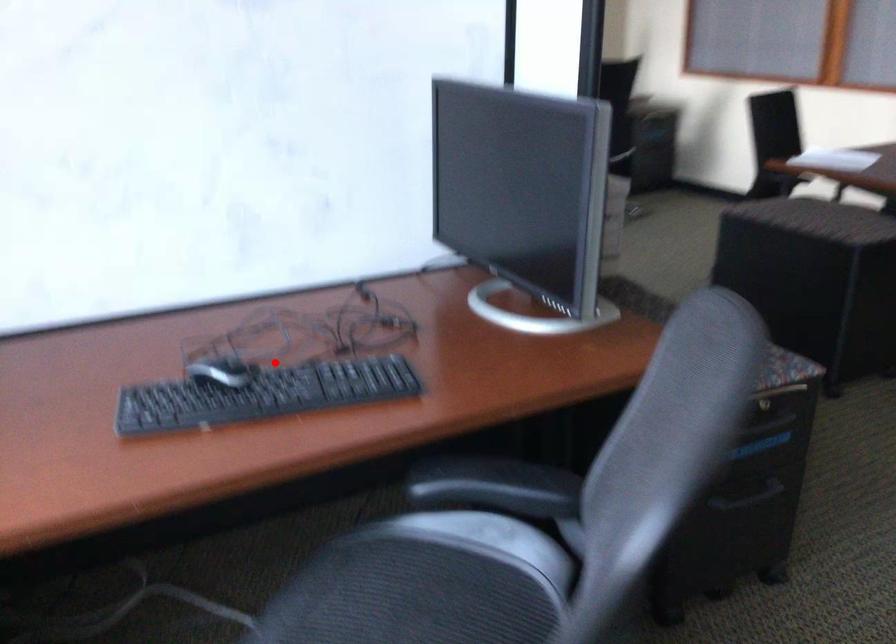
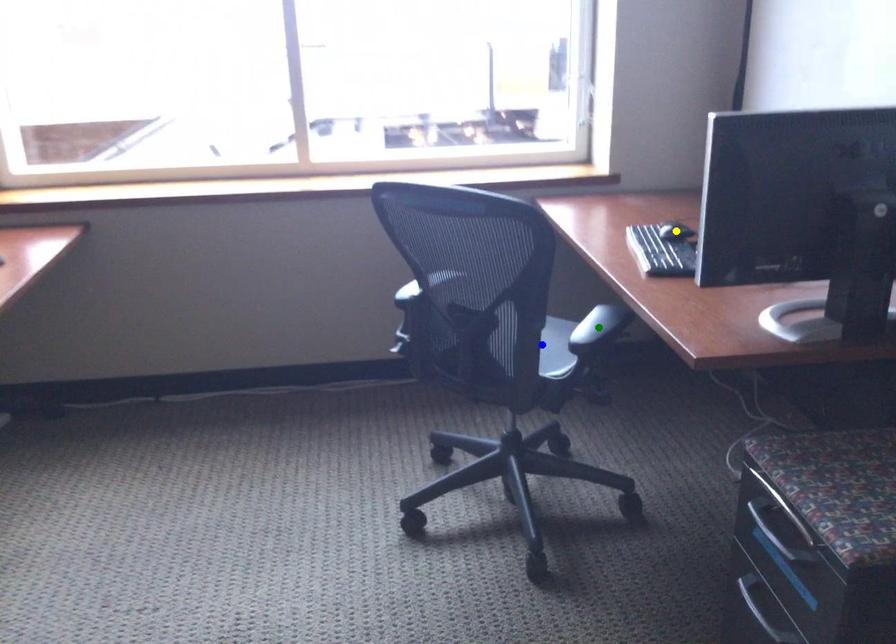
Question: I am providing you with two images of the same scene from different viewpoints. A red point is marked on the first image. You are given multiple points on the second image. Can you choose the point in image 2 that corresponds to the point in image 1?

Choices:
 (A) yellow point
 (B) green point
 (C) blue point

Answer: (A)